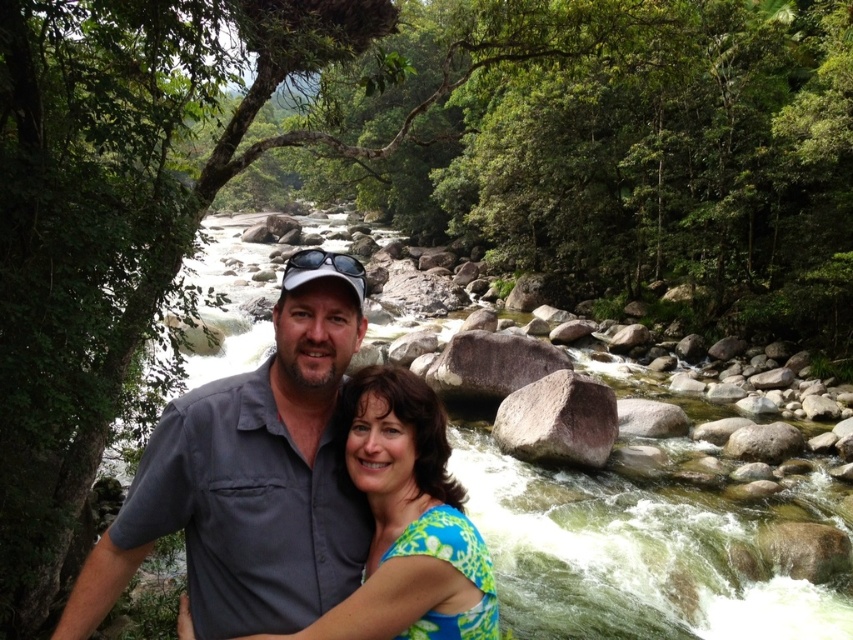
You are a photographer trying to capture a photo of the green floral dress at center and the smooth gray rock at center. Based on their positions, which object should you adjust your camera focus to first if you want to ensure both are in the frame?

The green floral dress at center is to the left of smooth gray rock at center, so you should focus on the green floral dress at center first to ensure both are in the frame.